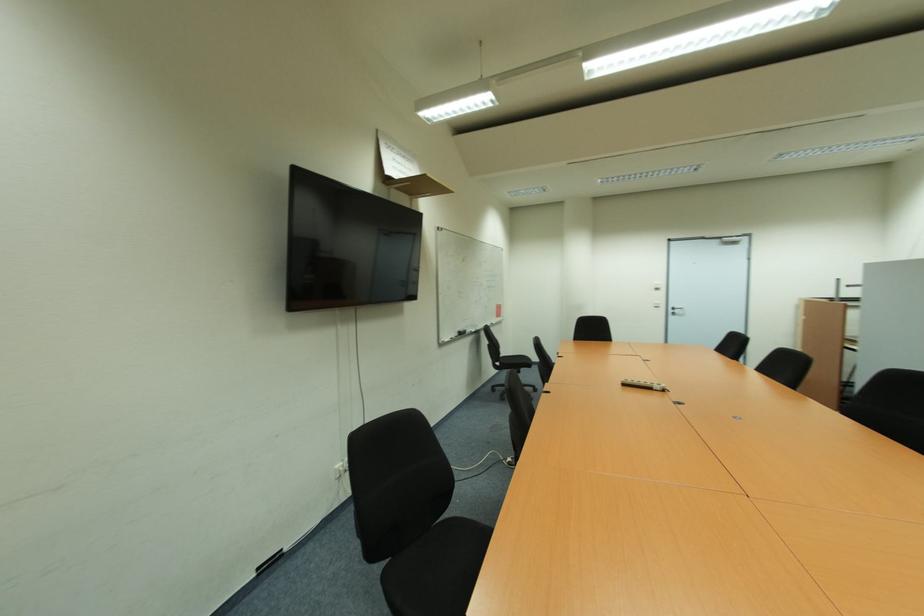
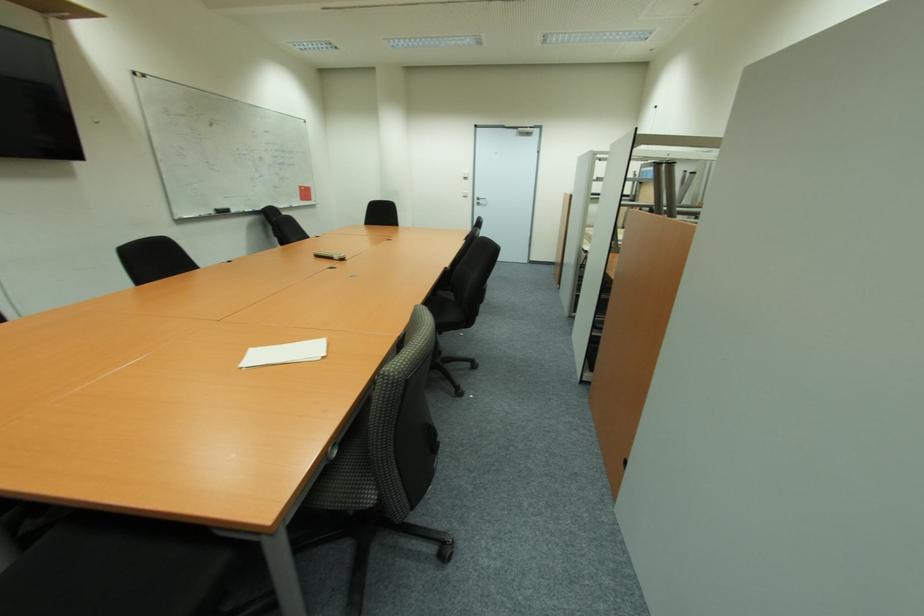
Locate, in the second image, the point that corresponds to point 653,390 in the first image.

(334, 259)